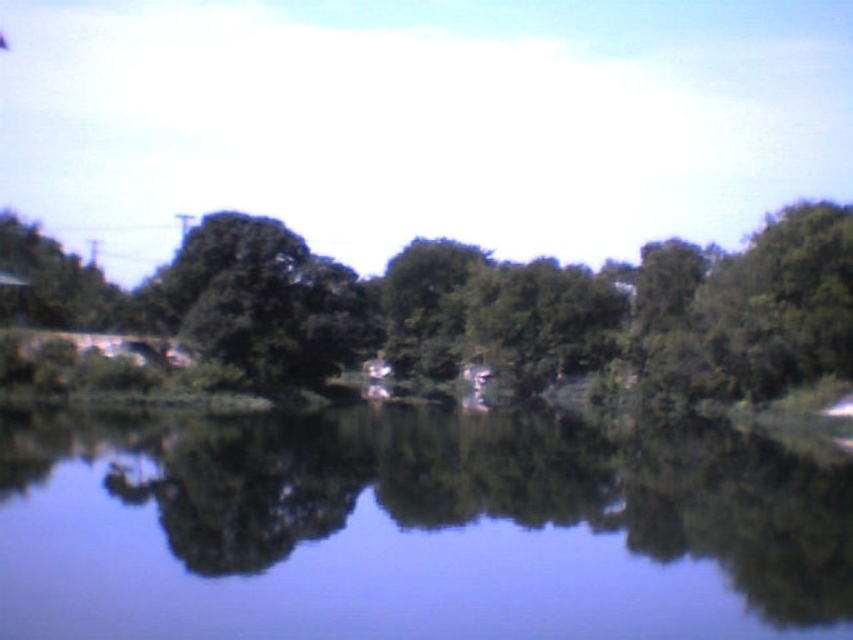
Which is above, transparent water at center or green leafy tree at center?

green leafy tree at center

Is transparent water at center further to the viewer compared to green leafy tree at center?

No, it is in front of green leafy tree at center.

The image size is (853, 640). What are the coordinates of `transparent water at center` in the screenshot? It's located at (415, 531).